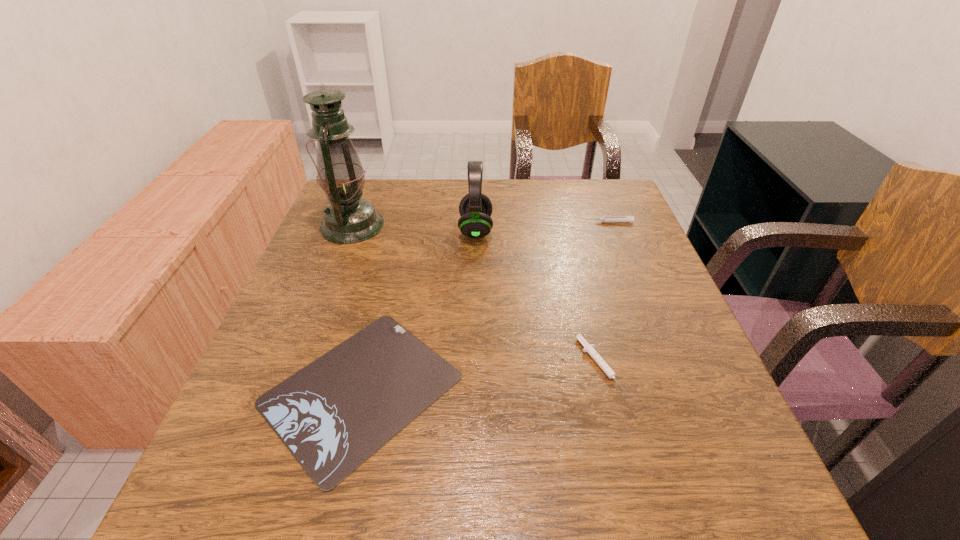
This screenshot has height=540, width=960. I want to click on the tallest object, so click(x=348, y=219).

In order to click on headset in this screenshot , I will do `click(475, 208)`.

The image size is (960, 540). Identify the location of the rightmost object. (630, 219).

Identify the location of the right syringe. (630, 219).

Locate an element on the screen. The width and height of the screenshot is (960, 540). the shorter syringe is located at coordinates (593, 353).

I want to click on the fourth object from left to right, so click(x=593, y=353).

Image resolution: width=960 pixels, height=540 pixels. Identify the location of the shortest object. (333, 414).

This screenshot has height=540, width=960. Find the location of `free point located on the back of the tallest object`. free point located on the back of the tallest object is located at coordinates (367, 187).

Find the location of a particular element. vacant space located on the ear cups of the headset is located at coordinates (530, 230).

At what (x,y) coordinates should I click in order to perform the action: click on free space located 0.330m at the needle end of the right syringe. Please return your answer as a coordinate pair (x, y). The width and height of the screenshot is (960, 540). Looking at the image, I should click on (466, 222).